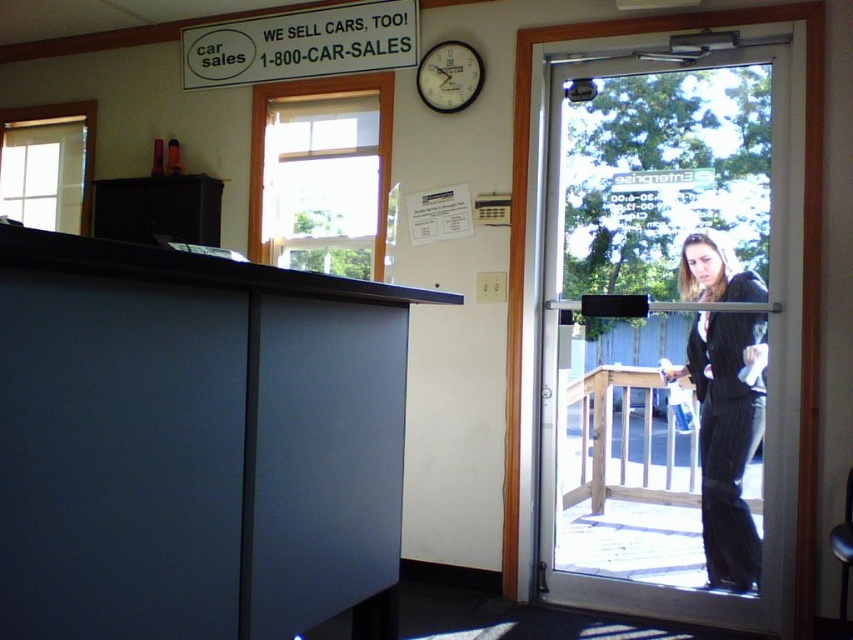
Can you confirm if transparent glass door at right is positioned above black pinstripe suit at door?

Correct, transparent glass door at right is located above black pinstripe suit at door.

Does transparent glass door at right have a lesser width compared to black pinstripe suit at door?

No.

Between point (515, 385) and point (729, 428), which one is positioned behind?

The point (515, 385) is behind.

You are a GUI agent. You are given a task and a screenshot of the screen. Output one action in this format:
    pyautogui.click(x=<x>, y=<y>)
    Task: Click on the transparent glass door at right
    The height and width of the screenshot is (640, 853).
    Given the screenshot: What is the action you would take?
    pyautogui.click(x=801, y=260)

Does transparent glass door at right have a larger size compared to wooden wall clock at upper center?

Indeed, transparent glass door at right has a larger size compared to wooden wall clock at upper center.

At what (x,y) coordinates should I click in order to perform the action: click on transparent glass door at right. Please return your answer as a coordinate pair (x, y). This screenshot has width=853, height=640. Looking at the image, I should click on (801, 260).

The image size is (853, 640). I want to click on transparent glass door at right, so click(801, 260).

Can you confirm if black pinstripe suit at door is positioned to the left of white plastic sign at upper center?

In fact, black pinstripe suit at door is to the right of white plastic sign at upper center.

Can you confirm if black pinstripe suit at door is taller than white plastic sign at upper center?

Correct, black pinstripe suit at door is much taller as white plastic sign at upper center.

Which is behind, point (732, 406) or point (373, 44)?

The point (373, 44) is behind.

The image size is (853, 640). I want to click on black pinstripe suit at door, so click(x=726, y=436).